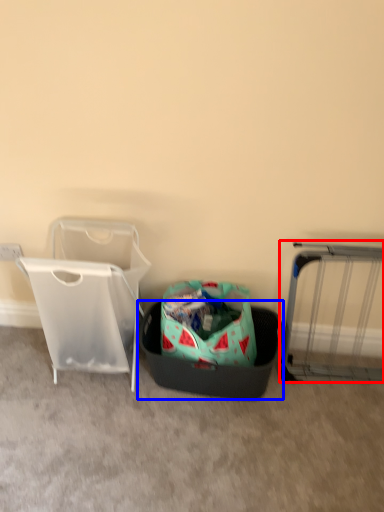
Question: Which of the following is the farthest to the observer, furniture (highlighted by a red box) or laundry basket (highlighted by a blue box)?

Choices:
 (A) furniture
 (B) laundry basket

Answer: (B)